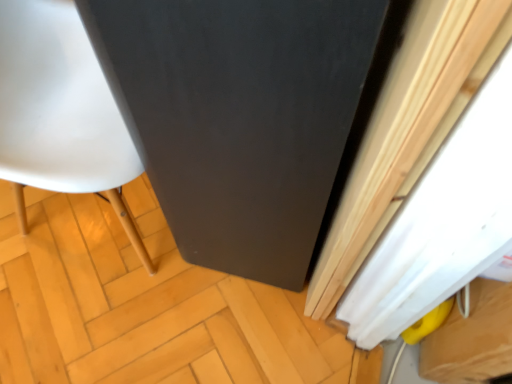
This screenshot has width=512, height=384. What do you see at coordinates (245, 117) in the screenshot?
I see `black matte screen door at center` at bounding box center [245, 117].

Where is `white matte curtain at right`? white matte curtain at right is located at coordinates (402, 128).

Considering the relative positions of white glossy chair at left and matte black cabinet at center in the image provided, is white glossy chair at left behind matte black cabinet at center?

That is False.

Measure the distance from white glossy chair at left to matte black cabinet at center.

The distance of white glossy chair at left from matte black cabinet at center is 11.57 inches.

Considering the sizes of white glossy chair at left and matte black cabinet at center in the image, is white glossy chair at left taller or shorter than matte black cabinet at center?

In the image, white glossy chair at left appears to be taller than matte black cabinet at center.

Considering the relative sizes of white glossy chair at left and matte black cabinet at center in the image provided, is white glossy chair at left smaller than matte black cabinet at center?

No.

In the scene shown: Is white matte curtain at right bigger than white glossy chair at left?

Actually, white matte curtain at right might be smaller than white glossy chair at left.

Is white matte curtain at right inside the boundaries of white glossy chair at left, or outside?

white matte curtain at right is located beyond the bounds of white glossy chair at left.

Find the location of a particular element. The image size is (512, 384). chair below the white matte curtain at right (from a real-world perspective) is located at coordinates (60, 112).

From a real-world perspective, who is located lower, matte black cabinet at center or black matte screen door at center?

In real-world perspective, matte black cabinet at center is lower.

The width and height of the screenshot is (512, 384). I want to click on plywood below the black matte screen door at center (from the image's perspective), so click(x=141, y=305).

From the image's perspective, is matte black cabinet at center under black matte screen door at center?

Indeed, from the image's perspective, matte black cabinet at center is shown beneath black matte screen door at center.

Is white matte curtain at right positioned with its back to black matte screen door at center?

That's right, white matte curtain at right is facing away from black matte screen door at center.

Does point (471, 49) lie behind point (336, 37)?

No.

Who is taller, white matte curtain at right or black matte screen door at center?

Standing taller between the two is white matte curtain at right.

Considering the relative sizes of black matte screen door at center and white glossy chair at left in the image provided, is black matte screen door at center bigger than white glossy chair at left?

Actually, black matte screen door at center might be smaller than white glossy chair at left.

Between point (255, 201) and point (1, 51), which one is positioned in front?

The point (255, 201) is more forward.

Does black matte screen door at center lie in front of white glossy chair at left?

Yes, black matte screen door at center is in front of white glossy chair at left.

Is the position of matte black cabinet at center more distant than that of white glossy chair at left?

That is True.

Would you say matte black cabinet at center is inside or outside white glossy chair at left?

matte black cabinet at center is spatially situated outside white glossy chair at left.

From the image's perspective, would you say matte black cabinet at center is shown under white glossy chair at left?

Correct, matte black cabinet at center appears lower than white glossy chair at left in the image.

Where is `curtain that is above the black matte screen door at center (from a real-world perspective)`? The height and width of the screenshot is (384, 512). curtain that is above the black matte screen door at center (from a real-world perspective) is located at coordinates (402, 128).

From the image's perspective, is black matte screen door at center below white matte curtain at right?

No, from the image's perspective, black matte screen door at center is not below white matte curtain at right.

From a real-world perspective, who is located higher, black matte screen door at center or white matte curtain at right?

white matte curtain at right, from a real-world perspective.

Is white matte curtain at right surrounded by black matte screen door at center?

No, white matte curtain at right is not surrounded by black matte screen door at center.

Locate an element on the screen. The height and width of the screenshot is (384, 512). plywood located underneath the white glossy chair at left (from a real-world perspective) is located at coordinates (141, 305).

Where is `curtain that is on the right side of white glossy chair at left`? The image size is (512, 384). curtain that is on the right side of white glossy chair at left is located at coordinates (402, 128).

Looking at the image, which one is located further to black matte screen door at center, white matte curtain at right or white glossy chair at left?

white glossy chair at left is positioned further to the anchor black matte screen door at center.

When comparing their distances from white matte curtain at right, does white glossy chair at left or matte black cabinet at center seem closer?

Based on the image, matte black cabinet at center appears to be nearer to white matte curtain at right.

Based on their spatial positions, is black matte screen door at center or white matte curtain at right further from white glossy chair at left?

The object further to white glossy chair at left is white matte curtain at right.

Looking at this image, from the image, which object appears to be nearer to black matte screen door at center, white glossy chair at left or white matte curtain at right?

white matte curtain at right lies closer to black matte screen door at center than the other object.

Looking at the image, which one is located further to white glossy chair at left, black matte screen door at center or matte black cabinet at center?

matte black cabinet at center.

From the image, which object appears to be farther from white matte curtain at right, white glossy chair at left or black matte screen door at center?

Among the two, white glossy chair at left is located further to white matte curtain at right.

Which object lies nearer to the anchor point matte black cabinet at center, black matte screen door at center or white matte curtain at right?

black matte screen door at center is positioned closer to the anchor matte black cabinet at center.

Considering their positions, is matte black cabinet at center positioned further to white matte curtain at right than white glossy chair at left?

Among the two, white glossy chair at left is located further to white matte curtain at right.

Locate an element on the screen. The height and width of the screenshot is (384, 512). screen door located between white glossy chair at left and white matte curtain at right in the left-right direction is located at coordinates (245, 117).

The image size is (512, 384). I want to click on screen door between white matte curtain at right and matte black cabinet at center from front to back, so click(245, 117).

You are a GUI agent. You are given a task and a screenshot of the screen. Output one action in this format:
    pyautogui.click(x=<x>, y=<y>)
    Task: Click on the plywood between white glossy chair at left and white matte curtain at right
    The width and height of the screenshot is (512, 384).
    Given the screenshot: What is the action you would take?
    pyautogui.click(x=141, y=305)

Identify the location of chair between black matte screen door at center and matte black cabinet at center along the z-axis. This screenshot has height=384, width=512. (60, 112).